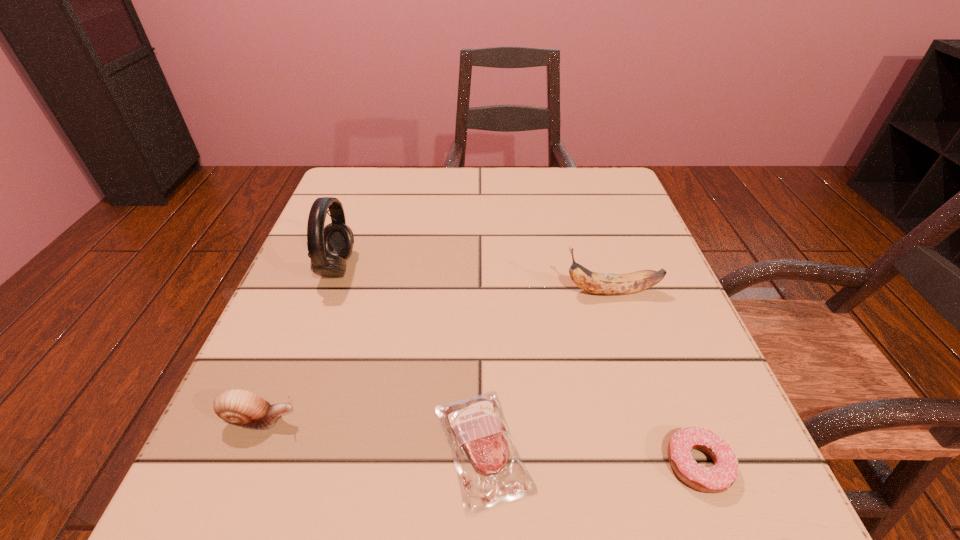
Image resolution: width=960 pixels, height=540 pixels. I want to click on vacant region that satisfies the following two spatial constraints: 1. on the peel of the banana; 2. on the right side of the doughnut, so click(666, 464).

What are the coordinates of `vacant space that satisfies the following two spatial constraints: 1. on the peel of the second shortest object; 2. on the right side of the second tallest object` in the screenshot? It's located at (666, 464).

The height and width of the screenshot is (540, 960). What are the coordinates of `free point that satisfies the following two spatial constraints: 1. on the front-facing side of the escargot; 2. on the right side of the third object from left to right` in the screenshot? It's located at (249, 448).

Where is `free space that satisfies the following two spatial constraints: 1. on the earcups of the headset; 2. on the back side of the doughnut`? The height and width of the screenshot is (540, 960). free space that satisfies the following two spatial constraints: 1. on the earcups of the headset; 2. on the back side of the doughnut is located at coordinates (265, 464).

This screenshot has width=960, height=540. In order to click on vacant area that satisfies the following two spatial constraints: 1. on the earcups of the steak; 2. on the right side of the headset in this screenshot , I will do `click(271, 448)`.

The width and height of the screenshot is (960, 540). I want to click on free location that satisfies the following two spatial constraints: 1. on the front-facing side of the third tallest object; 2. on the back side of the second shortest object, so click(x=242, y=464).

Image resolution: width=960 pixels, height=540 pixels. In order to click on free location that satisfies the following two spatial constraints: 1. on the back side of the fourth tallest object; 2. on the front-facing side of the escargot in this screenshot , I will do `click(682, 420)`.

Find the location of a particular element. Image resolution: width=960 pixels, height=540 pixels. free space that satisfies the following two spatial constraints: 1. on the front-facing side of the fourth tallest object; 2. on the left side of the third shortest object is located at coordinates [242, 464].